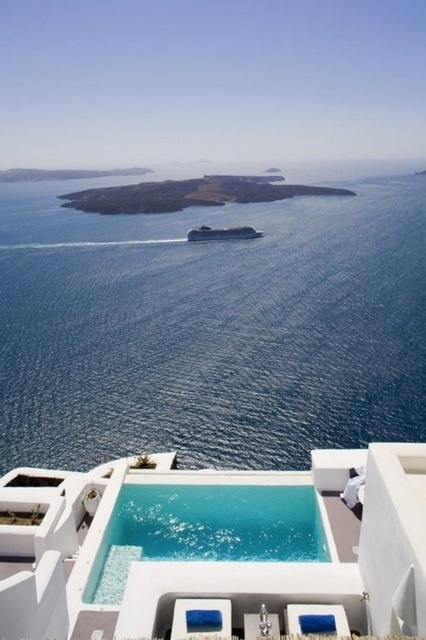
Can you confirm if blue liquid water at center is positioned to the right of white glossy pool at center?

Incorrect, blue liquid water at center is not on the right side of white glossy pool at center.

Can you confirm if blue liquid water at center is smaller than white glossy pool at center?

No.

This screenshot has width=426, height=640. Describe the element at coordinates (210, 328) in the screenshot. I see `blue liquid water at center` at that location.

Find the location of a particular element. blue liquid water at center is located at coordinates (210, 328).

Is blue liquid water at center further to camera compared to crystal clear glass pool at center?

Yes, it is.

Who is lower down, blue liquid water at center or crystal clear glass pool at center?

crystal clear glass pool at center is lower down.

The height and width of the screenshot is (640, 426). I want to click on blue liquid water at center, so click(210, 328).

The width and height of the screenshot is (426, 640). I want to click on blue liquid water at center, so click(x=210, y=328).

Measure the distance from white glossy pool at center to crystal clear glass pool at center.

white glossy pool at center and crystal clear glass pool at center are 7.30 feet apart from each other.

The width and height of the screenshot is (426, 640). What do you see at coordinates (215, 548) in the screenshot?
I see `white glossy pool at center` at bounding box center [215, 548].

This screenshot has height=640, width=426. Identify the location of white glossy pool at center. (215, 548).